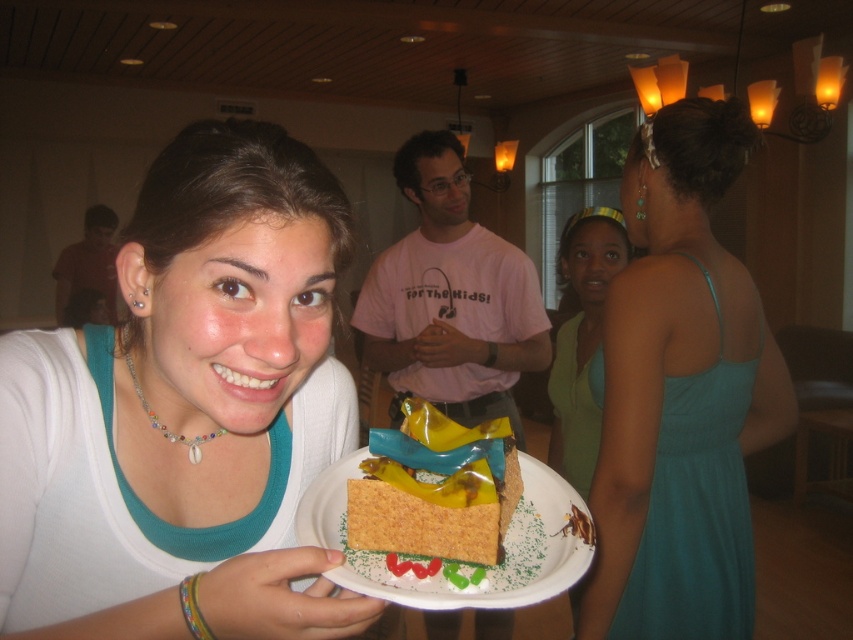
Is teal satin dress at center smaller than pink cotton shirt at center?

Correct, teal satin dress at center occupies less space than pink cotton shirt at center.

What do you see at coordinates (680, 394) in the screenshot?
I see `teal satin dress at center` at bounding box center [680, 394].

You are a GUI agent. You are given a task and a screenshot of the screen. Output one action in this format:
    pyautogui.click(x=<x>, y=<y>)
    Task: Click on the teal satin dress at center
    This screenshot has width=853, height=640.
    Given the screenshot: What is the action you would take?
    pyautogui.click(x=680, y=394)

You are a GUI agent. You are given a task and a screenshot of the screen. Output one action in this format:
    pyautogui.click(x=<x>, y=<y>)
    Task: Click on the teal satin dress at center
    This screenshot has width=853, height=640.
    Given the screenshot: What is the action you would take?
    pyautogui.click(x=680, y=394)

Between point (409, 493) and point (76, 314), which one is positioned behind?

The point (76, 314) is more distant.

Is yellow matte cake at center closer to the viewer compared to matte red shirt at left?

Yes, yellow matte cake at center is in front of matte red shirt at left.

Where is `yellow matte cake at center`? This screenshot has height=640, width=853. yellow matte cake at center is located at coordinates (432, 509).

Who is higher up, pink cotton shirt at center or matte brown cake at center?

pink cotton shirt at center is higher up.

Is pink cotton shirt at center above matte brown cake at center?

Correct, pink cotton shirt at center is located above matte brown cake at center.

Between point (364, 307) and point (323, 536), which one is positioned in front?

Point (323, 536)

Image resolution: width=853 pixels, height=640 pixels. Identify the location of pink cotton shirt at center. (450, 298).